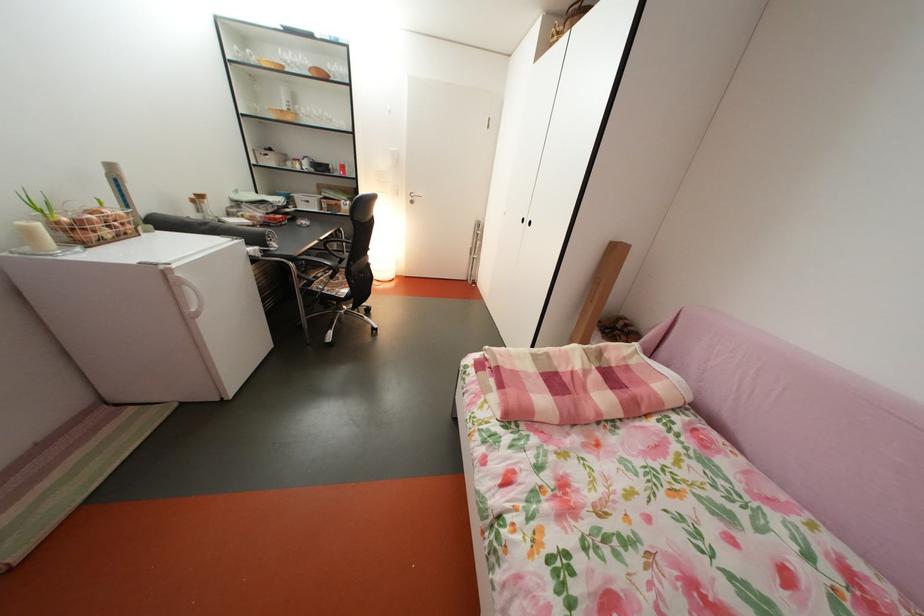
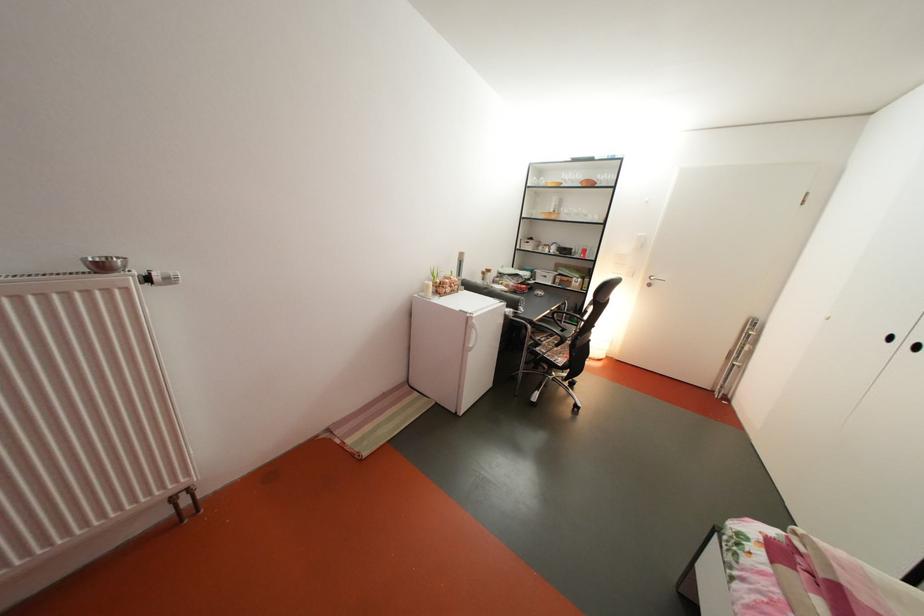
The point at (41, 238) is marked in the first image. Where is the corresponding point in the second image?

(439, 293)